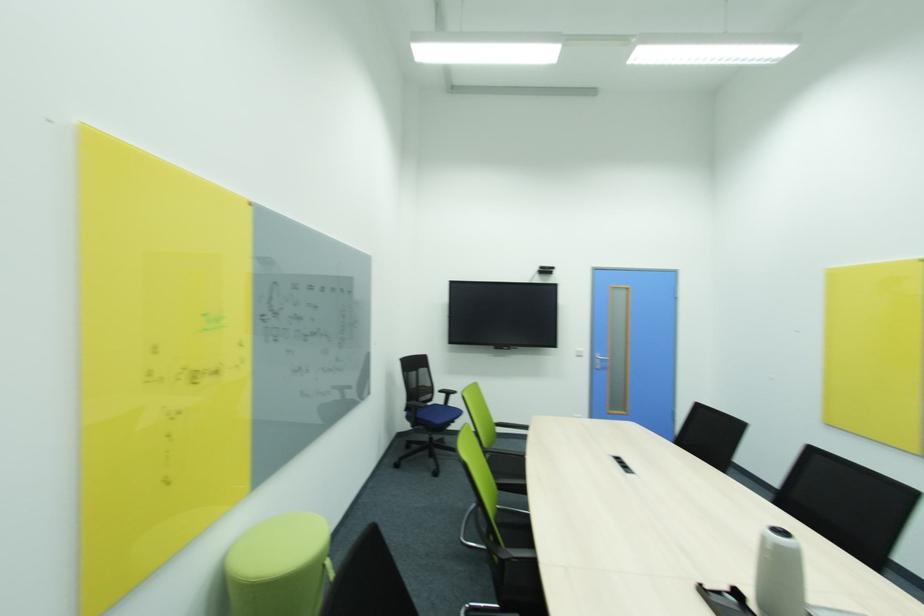
What do you see at coordinates (424, 410) in the screenshot? Image resolution: width=924 pixels, height=616 pixels. I see `the black chair armrest` at bounding box center [424, 410].